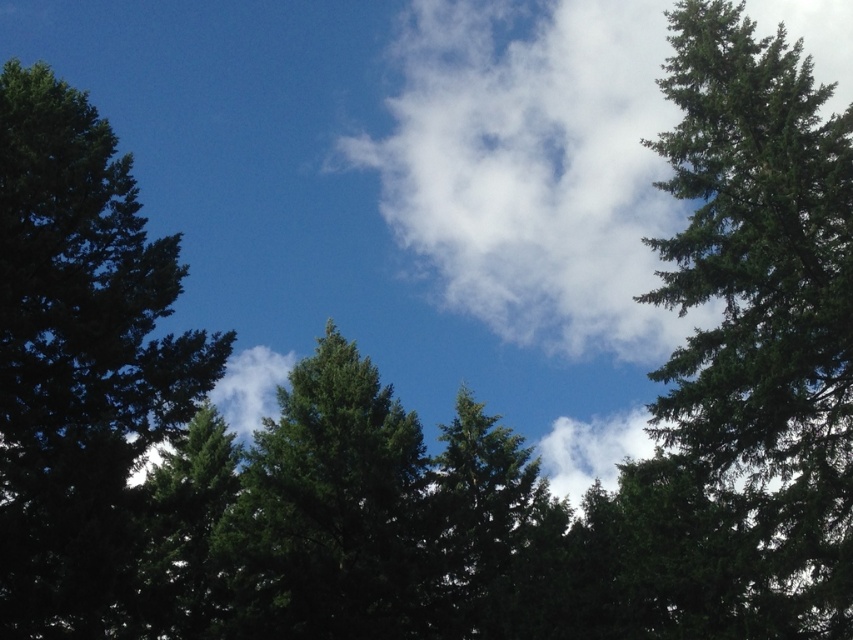
Question: Which object is farther from the camera taking this photo?

Choices:
 (A) dark green textured tree at left
 (B) white fluffy cloud at center
 (C) green textured tree at right

Answer: (B)

Question: Is dark green textured tree at left wider than green matte tree at center?

Choices:
 (A) yes
 (B) no

Answer: (B)

Question: Which object is farther from the camera taking this photo?

Choices:
 (A) green matte tree at center
 (B) white fluffy cloud at center

Answer: (B)

Question: Which point appears closest to the camera in this image?

Choices:
 (A) (648, 189)
 (B) (138, 428)
 (C) (776, 259)
 (D) (258, 621)

Answer: (C)

Question: Is green textured tree at right wider than white fluffy cloud at center?

Choices:
 (A) no
 (B) yes

Answer: (A)

Question: From the image, what is the correct spatial relationship of white fluffy cloud at center in relation to dark green textured tree at left?

Choices:
 (A) above
 (B) below

Answer: (A)